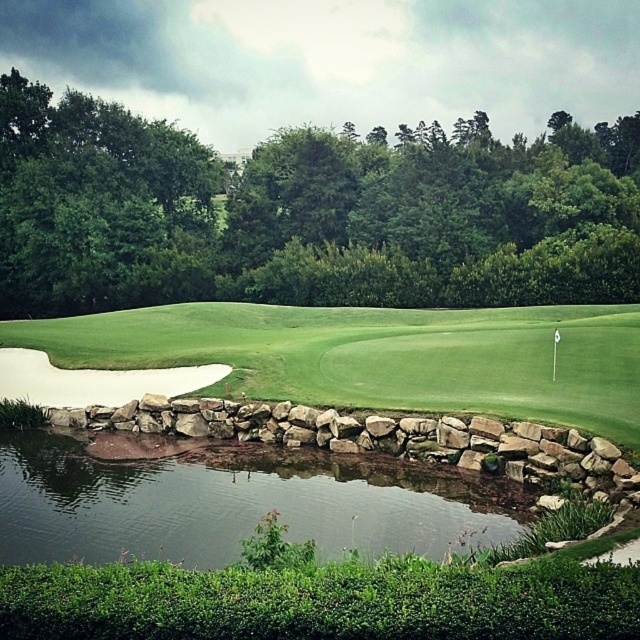
You are a golfer standing on the fairway. You see the green leafy tree at upper center and the clear water at pond center. Which object is closer to you?

The green leafy tree at upper center is closer to you than the clear water at pond center because the clear water at pond center is behind the green leafy tree at upper center.

You are standing at point (307, 212) on the golf course. What do you see directly in front of you?

At point (307, 212) lies green leafy tree at upper center, so you would see the green leafy tree at upper center directly in front of you.

You are a golfer standing at the tee, aiming to hit your ball towards the green leafy tree at upper center. Based on the scene, can you determine the direction you should hit your ball to reach the tree?

The green leafy tree at upper center is located at point (x=307, y=212), so you should aim your shot towards the upper center direction to reach the tree.